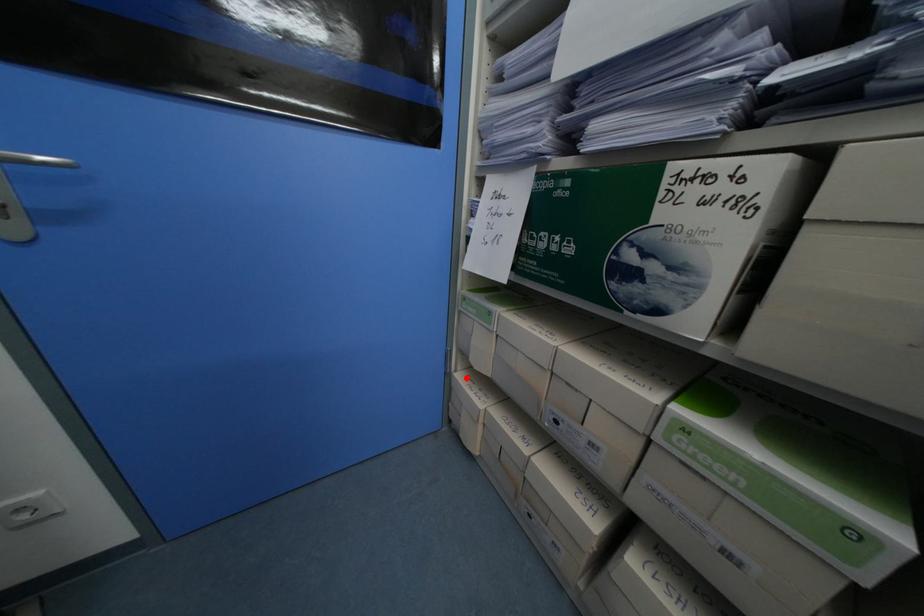
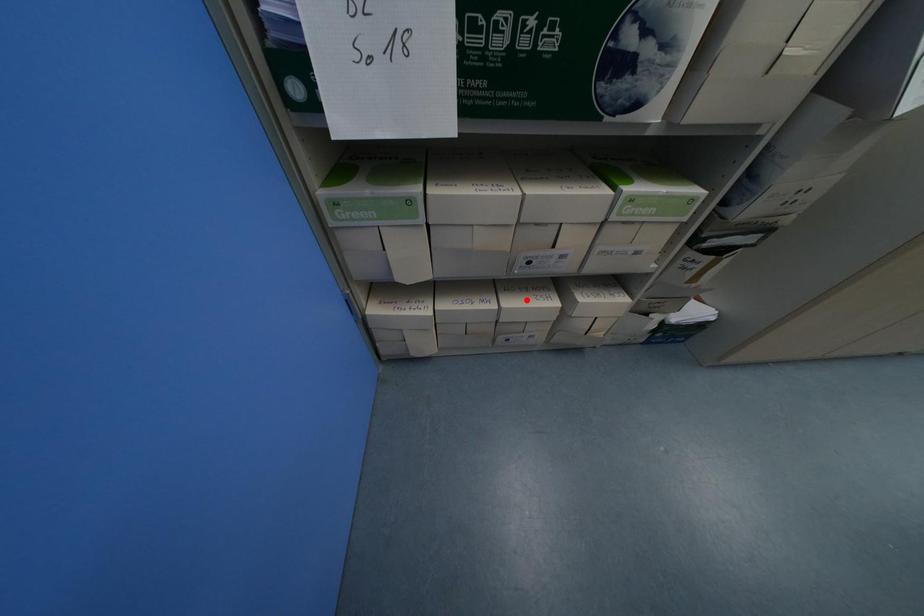
I am providing you with two images of the same scene from different viewpoints. A red point is marked on the first image and another point is marked on the second image. Is the marked point in image1 the same physical position as the marked point in image2?

No